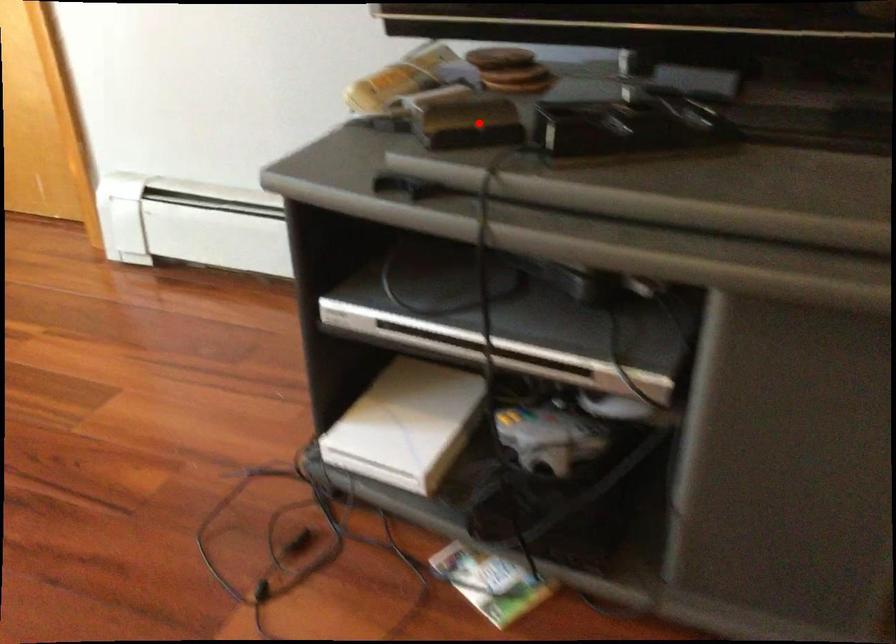
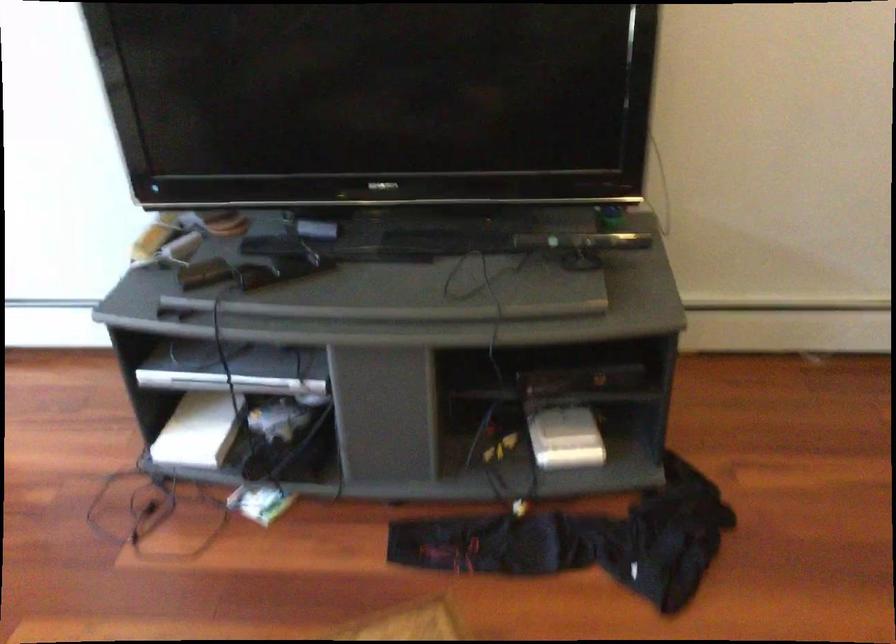
In the second image, find the point that corresponds to the highlighted location in the first image.

(203, 272)